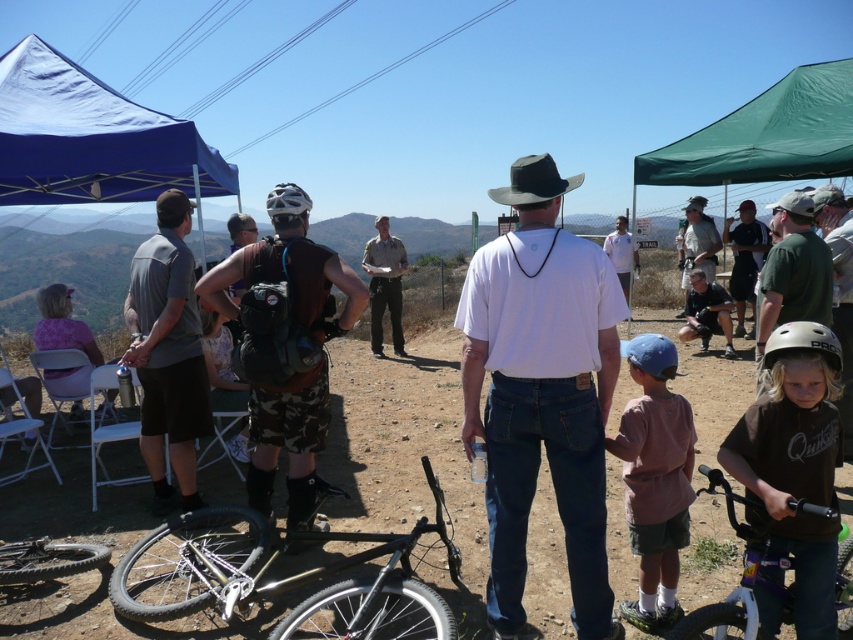
Who is more forward, (x=807, y=321) or (x=628, y=262)?

Positioned in front is point (x=807, y=321).

Locate an element on the screen. The width and height of the screenshot is (853, 640). tan matte helmet at lower right is located at coordinates [x=802, y=342].

Is shiny black bicycle at lower left above dark green shirt at center?

Actually, shiny black bicycle at lower left is below dark green shirt at center.

Between point (74, 566) and point (744, 256), which one is positioned in front?

Point (74, 566)

At what (x,y) coordinates should I click in order to perform the action: click on shiny black bicycle at lower left. Please return your answer as a coordinate pair (x, y). Looking at the image, I should click on (47, 560).

Can you confirm if gray fabric shirt at left is positioned above blue matte helmet at center?

Yes, gray fabric shirt at left is above blue matte helmet at center.

Measure the distance between point (193,419) and camera.

The distance of point (193,419) from camera is 4.63 meters.

Where is `gray fabric shirt at left`? The image size is (853, 640). gray fabric shirt at left is located at coordinates [167, 353].

At what (x,y) coordinates should I click in order to perform the action: click on gray fabric shirt at left. Please return your answer as a coordinate pair (x, y). This screenshot has width=853, height=640. Looking at the image, I should click on (167, 353).